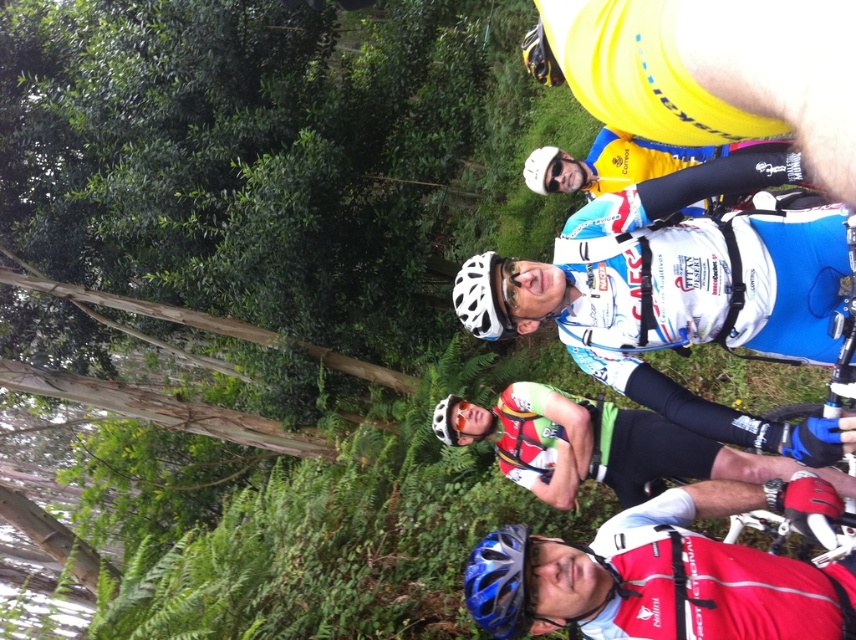
The image size is (856, 640). What do you see at coordinates (247, 157) in the screenshot?
I see `green leafy tree at upper left` at bounding box center [247, 157].

Based on the photo, is green leafy tree at upper left bigger than red matte helmet at center?

Yes, green leafy tree at upper left is bigger than red matte helmet at center.

Where is `green leafy tree at upper left`? green leafy tree at upper left is located at coordinates (247, 157).

Where is `green leafy tree at upper left`? green leafy tree at upper left is located at coordinates (247, 157).

Is white matte bicycle helmet at center shorter than white matte goggles at center?

Incorrect, white matte bicycle helmet at center's height does not fall short of white matte goggles at center's.

Where is `white matte bicycle helmet at center`? This screenshot has width=856, height=640. white matte bicycle helmet at center is located at coordinates (480, 298).

Who is taller, red matte helmet at center or white matte bicycle helmet at center?

red matte helmet at center

Is red matte helmet at center wider than white matte bicycle helmet at center?

Yes.

Which is in front, point (610, 529) or point (480, 296)?

Point (480, 296) is more forward.

Find the location of `red matte helmet at center`. red matte helmet at center is located at coordinates (667, 573).